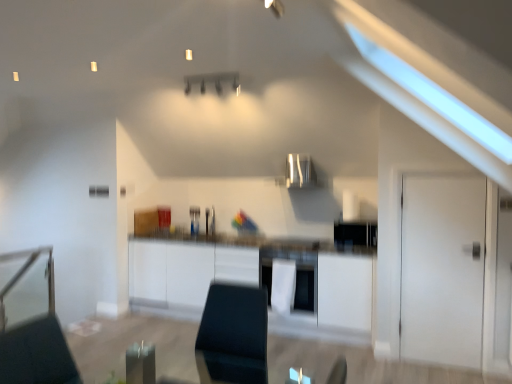
Question: Is white matte door at right aimed at satin silver exhaust hood at center?

Choices:
 (A) no
 (B) yes

Answer: (A)

Question: Can you confirm if white matte door at right is bigger than satin silver exhaust hood at center?

Choices:
 (A) yes
 (B) no

Answer: (B)

Question: Is white matte door at right outside of satin silver exhaust hood at center?

Choices:
 (A) no
 (B) yes

Answer: (B)

Question: Considering the relative positions of white matte door at right and satin silver exhaust hood at center in the image provided, is white matte door at right to the right of satin silver exhaust hood at center from the viewer's perspective?

Choices:
 (A) yes
 (B) no

Answer: (A)

Question: From the image's perspective, is white matte door at right located beneath satin silver exhaust hood at center?

Choices:
 (A) no
 (B) yes

Answer: (B)

Question: Is white matte door at right taller than satin silver exhaust hood at center?

Choices:
 (A) yes
 (B) no

Answer: (A)

Question: Is white matte cabinet at center not close to white matte door at right?

Choices:
 (A) yes
 (B) no

Answer: (A)

Question: Can you confirm if white matte cabinet at center is shorter than white matte door at right?

Choices:
 (A) yes
 (B) no

Answer: (A)

Question: Is white matte cabinet at center smaller than white matte door at right?

Choices:
 (A) no
 (B) yes

Answer: (A)

Question: Considering the relative sizes of white matte cabinet at center and white matte door at right in the image provided, is white matte cabinet at center bigger than white matte door at right?

Choices:
 (A) yes
 (B) no

Answer: (A)

Question: Is white matte cabinet at center further to the viewer compared to white matte door at right?

Choices:
 (A) yes
 (B) no

Answer: (A)

Question: From a real-world perspective, is white matte cabinet at center located higher than white matte door at right?

Choices:
 (A) yes
 (B) no

Answer: (B)

Question: Does white matte cabinet at center lie in front of satin silver exhaust hood at center?

Choices:
 (A) no
 (B) yes

Answer: (B)